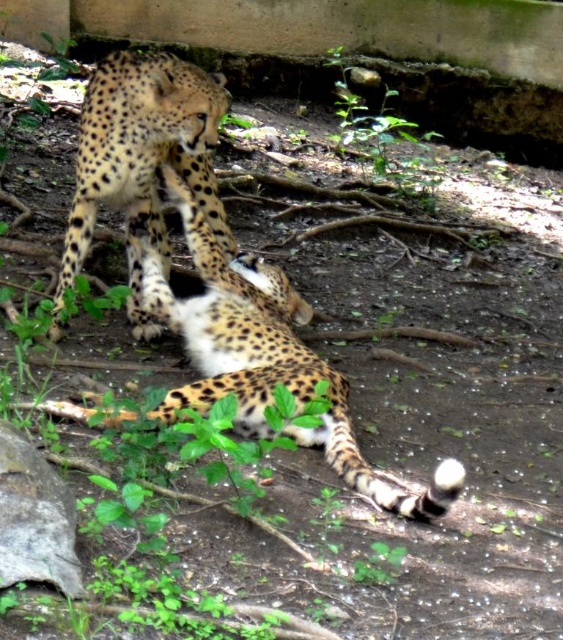
You are a zookeeper observing two points in the enclosure where cheetahs might be resting. The points are labeled as point (127, 419) and point (196, 88). Based on the image, which point is closer to you?

Point (127, 419) is closer to the viewer than point (196, 88).

You are a zookeeper observing two cheetahs in their enclosure. You notice a point marked at coordinates (276,374). Which cheetah does this point correspond to?

The point at coordinates (276,374) corresponds to the spotted fur cheetah at center.